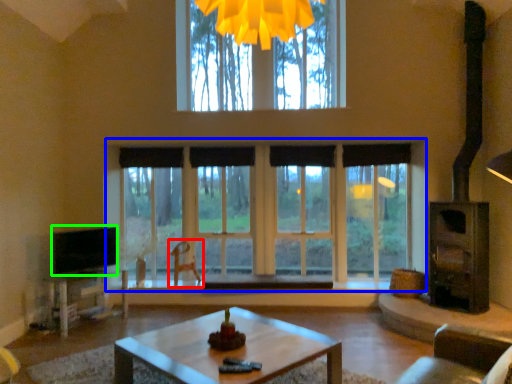
Question: Which object is the closest to the swivel chair (highlighted by a red box)? Choose among these: window (highlighted by a blue box) or level (highlighted by a green box).

Choices:
 (A) window
 (B) level

Answer: (B)